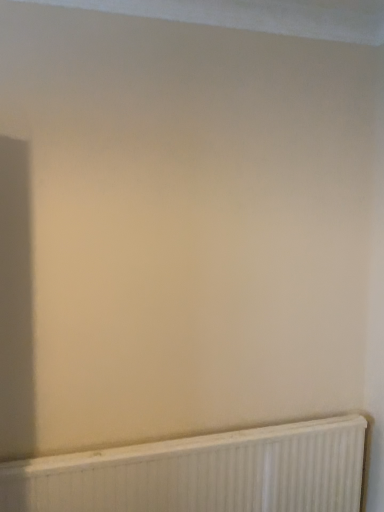
This screenshot has height=512, width=384. In order to click on white ribbed radiator at bottom in this screenshot , I will do pyautogui.click(x=202, y=473).

What do you see at coordinates (202, 473) in the screenshot?
I see `white ribbed radiator at bottom` at bounding box center [202, 473].

The height and width of the screenshot is (512, 384). What are the coordinates of `white ribbed radiator at bottom` in the screenshot? It's located at (202, 473).